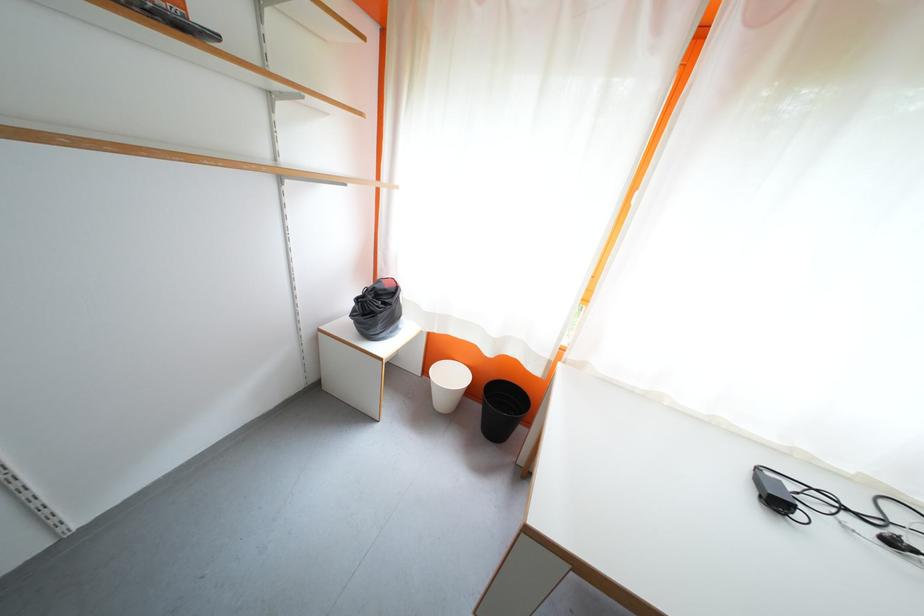
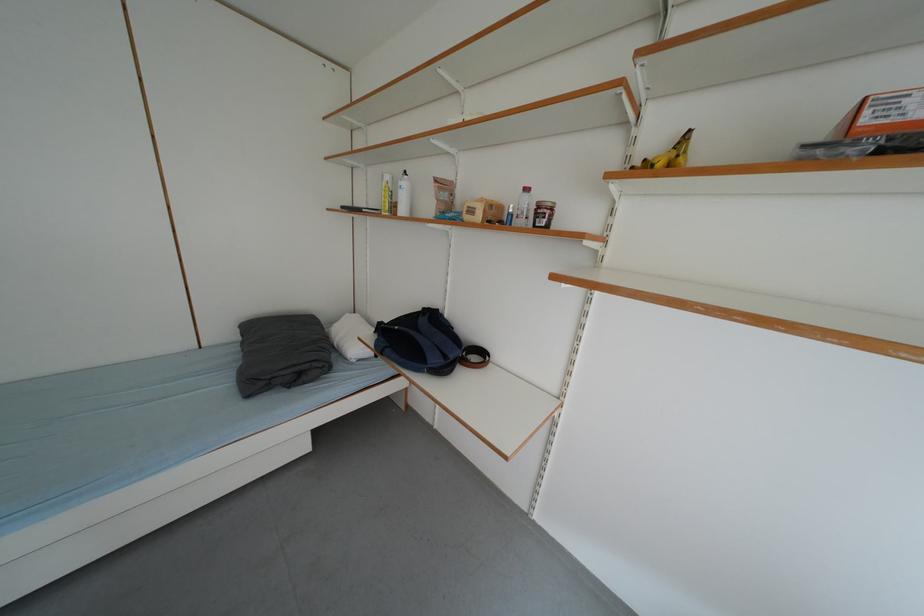
Question: The first image is from the beginning of the video and the second image is from the end. How did the camera likely rotate when shooting the video?

Choices:
 (A) Left
 (B) Right
 (C) Up
 (D) Down

Answer: (A)